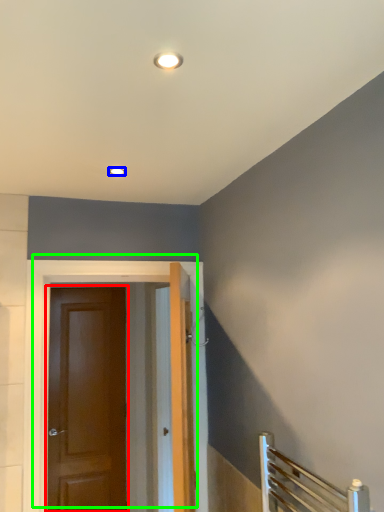
Question: Which object is positioned farthest from door (highlighted by a red box)? Select from lighting (highlighted by a blue box) and door (highlighted by a green box).

Choices:
 (A) lighting
 (B) door

Answer: (A)